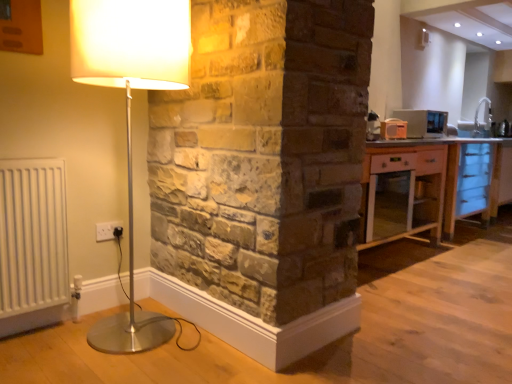
I want to click on matte white lamp at left, so pos(130,113).

Where is `white ceramic sink at upper right`? white ceramic sink at upper right is located at coordinates (478, 122).

How different are the orientations of white ceramic sink at upper right and metallic silver microwave at upper right in degrees?

The facing directions of white ceramic sink at upper right and metallic silver microwave at upper right are 41.4 degrees apart.

You are a GUI agent. You are given a task and a screenshot of the screen. Output one action in this format:
    pyautogui.click(x=<x>, y=<y>)
    Task: Click on the appliance located underneath the white ceramic sink at upper right (from a real-world perspective)
    Image resolution: width=512 pixels, height=384 pixels.
    Given the screenshot: What is the action you would take?
    pyautogui.click(x=423, y=122)

From the image's perspective, is white ceramic sink at upper right beneath metallic silver microwave at upper right?

No, from the image's perspective, white ceramic sink at upper right is not below metallic silver microwave at upper right.

Which object is positioned more to the right, light wood cabinet at right or white ceramic sink at upper right?

white ceramic sink at upper right.

Does light wood cabinet at right have a lesser width compared to white ceramic sink at upper right?

Incorrect, the width of light wood cabinet at right is not less than that of white ceramic sink at upper right.

How much distance is there between light wood cabinet at right and white ceramic sink at upper right?

light wood cabinet at right is 1.75 meters from white ceramic sink at upper right.

Does light wood cabinet at right lie in front of white ceramic sink at upper right?

Yes, it is.

How different are the orientations of metallic silver microwave at upper right and white ceramic sink at upper right in degrees?

The angle between the facing direction of metallic silver microwave at upper right and the facing direction of white ceramic sink at upper right is 41.4 degrees.

Locate an element on the screen. sink above the metallic silver microwave at upper right (from the image's perspective) is located at coordinates [478, 122].

Which object is positioned more to the left, metallic silver microwave at upper right or white ceramic sink at upper right?

Positioned to the left is metallic silver microwave at upper right.

Is point (438, 129) positioned in front of point (391, 227)?

No.

From the image's perspective, which one is positioned higher, metallic silver microwave at upper right or light wood cabinet at right?

From the image's view, metallic silver microwave at upper right is above.

In the scene shown: Is metallic silver microwave at upper right positioned with its back to light wood cabinet at right?

No, metallic silver microwave at upper right is not facing the opposite direction of light wood cabinet at right.

From a real-world perspective, who is located lower, metallic silver microwave at upper right or light wood cabinet at right?

light wood cabinet at right.

From a real-world perspective, between white ceramic sink at upper right and matte white lamp at left, who is vertically higher?

From a 3D spatial view, white ceramic sink at upper right is above.

From the image's perspective, between white ceramic sink at upper right and matte white lamp at left, which one is located above?

white ceramic sink at upper right appears higher in the image.

How many degrees apart are the facing directions of white ceramic sink at upper right and matte white lamp at left?

40.9 degrees.

Where is `lamp located underneath the white ceramic sink at upper right (from a real-world perspective)`? lamp located underneath the white ceramic sink at upper right (from a real-world perspective) is located at coordinates (130, 113).

Is matte white lamp at left not near white ceramic sink at upper right?

Yes.

Is matte white lamp at left aimed at white ceramic sink at upper right?

No, matte white lamp at left does not turn towards white ceramic sink at upper right.

Visually, is matte white lamp at left positioned to the left or to the right of white ceramic sink at upper right?

Clearly, matte white lamp at left is on the left of white ceramic sink at upper right in the image.

From a real-world perspective, which object stands above the other?

In real-world perspective, white ceramic sink at upper right is above.

Considering the relative positions of matte white lamp at left and metallic silver microwave at upper right in the image provided, is matte white lamp at left to the right of metallic silver microwave at upper right from the viewer's perspective?

Incorrect, matte white lamp at left is not on the right side of metallic silver microwave at upper right.

Considering the relative sizes of matte white lamp at left and metallic silver microwave at upper right in the image provided, is matte white lamp at left taller than metallic silver microwave at upper right?

Yes.

From a real-world perspective, is matte white lamp at left beneath metallic silver microwave at upper right?

Yes, from a real-world perspective, matte white lamp at left is under metallic silver microwave at upper right.

Is matte white lamp at left bigger or smaller than metallic silver microwave at upper right?

matte white lamp at left is bigger than metallic silver microwave at upper right.

This screenshot has height=384, width=512. I want to click on appliance in front of the white ceramic sink at upper right, so click(x=423, y=122).

Identify the location of cabinetry below the white ceramic sink at upper right (from the image's perspective). Image resolution: width=512 pixels, height=384 pixels. (431, 186).

Looking at the image, which one is located further to metallic silver microwave at upper right, white ceramic sink at upper right or light wood cabinet at right?

white ceramic sink at upper right lies further to metallic silver microwave at upper right than the other object.

Looking at the image, which one is located closer to light wood cabinet at right, metallic silver microwave at upper right or matte white lamp at left?

Based on the image, metallic silver microwave at upper right appears to be nearer to light wood cabinet at right.

From the image, which object appears to be nearer to light wood cabinet at right, matte white lamp at left or white ceramic sink at upper right?

white ceramic sink at upper right is positioned closer to the anchor light wood cabinet at right.

From the image, which object appears to be farther from white ceramic sink at upper right, light wood cabinet at right or matte white lamp at left?

matte white lamp at left lies further to white ceramic sink at upper right than the other object.

Looking at the image, which one is located closer to metallic silver microwave at upper right, light wood cabinet at right or white ceramic sink at upper right?

light wood cabinet at right lies closer to metallic silver microwave at upper right than the other object.

From the image, which object appears to be farther from light wood cabinet at right, matte white lamp at left or metallic silver microwave at upper right?

The object further to light wood cabinet at right is matte white lamp at left.

Looking at the image, which one is located further to matte white lamp at left, white ceramic sink at upper right or light wood cabinet at right?

white ceramic sink at upper right.

Estimate the real-world distances between objects in this image. Which object is further from light wood cabinet at right, metallic silver microwave at upper right or white ceramic sink at upper right?

white ceramic sink at upper right is positioned further to the anchor light wood cabinet at right.

The width and height of the screenshot is (512, 384). I want to click on appliance between matte white lamp at left and white ceramic sink at upper right along the z-axis, so click(423, 122).

The height and width of the screenshot is (384, 512). I want to click on cabinetry located between matte white lamp at left and white ceramic sink at upper right in the depth direction, so click(x=431, y=186).

You are a GUI agent. You are given a task and a screenshot of the screen. Output one action in this format:
    pyautogui.click(x=<x>, y=<y>)
    Task: Click on the appliance located between light wood cabinet at right and white ceramic sink at upper right in the depth direction
    The image size is (512, 384).
    Given the screenshot: What is the action you would take?
    pyautogui.click(x=423, y=122)

Identify the location of cabinetry positioned between matte white lamp at left and metallic silver microwave at upper right from near to far. This screenshot has height=384, width=512. (431, 186).